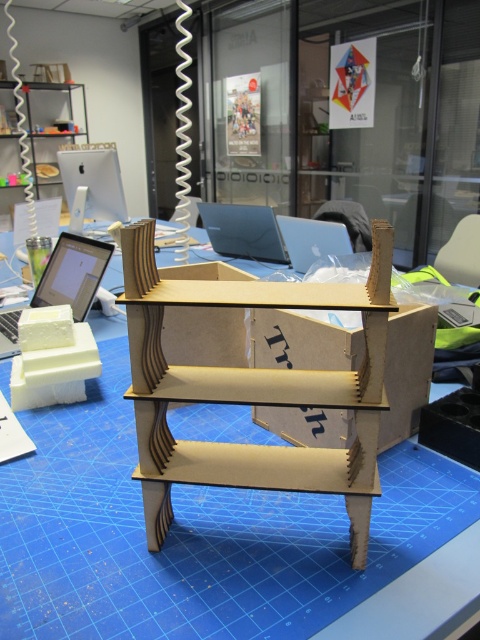
Who is higher up, wooden shelf at center or satin black laptop at center?

satin black laptop at center is above.

Does wooden shelf at center appear under satin black laptop at center?

Correct, wooden shelf at center is located below satin black laptop at center.

Which is behind, point (460, 493) or point (208, 214)?

The point (208, 214) is behind.

Where is `wooden shelf at center`? The width and height of the screenshot is (480, 640). wooden shelf at center is located at coordinates (212, 540).

Can you confirm if wooden shelf at center is positioned below satin silver laptop at center?

Correct, wooden shelf at center is located below satin silver laptop at center.

Is point (211, 412) farther from viewer compared to point (325, 230)?

No.

Between point (295, 621) and point (300, 257), which one is positioned in front?

Positioned in front is point (295, 621).

The image size is (480, 640). I want to click on wooden shelf at center, so click(212, 540).

Is wooden shelf at center further to the viewer compared to white plastic computer at upper left?

No.

Does wooden shelf at center have a smaller size compared to white plastic computer at upper left?

Actually, wooden shelf at center might be larger than white plastic computer at upper left.

Does point (387, 376) come closer to viewer compared to point (75, 163)?

That is True.

Identify the location of wooden shelf at center. The width and height of the screenshot is (480, 640). (212, 540).